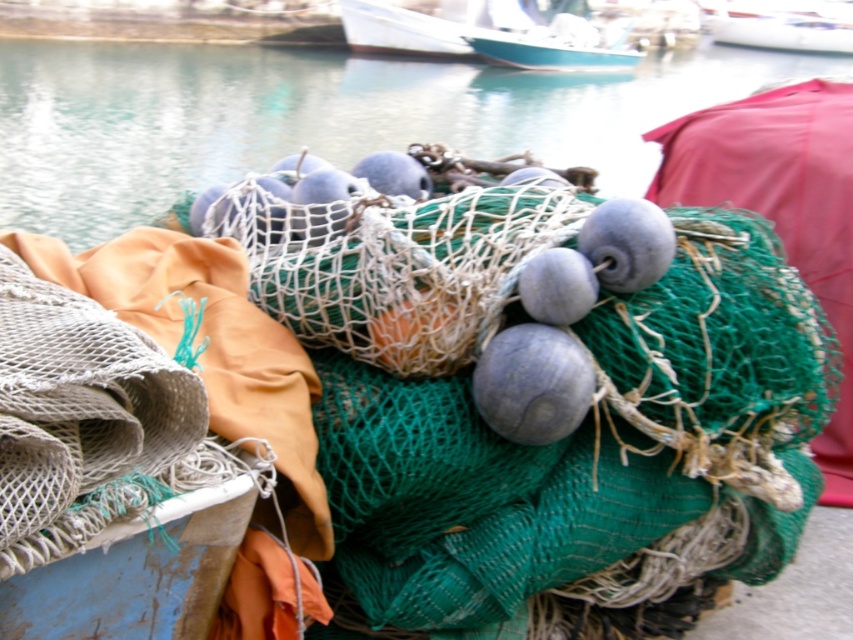
Is green netting at center positioned behind teal glossy boat at upper center?

No, green netting at center is in front of teal glossy boat at upper center.

Which is behind, point (548, 77) or point (576, 32)?

The point (576, 32) is behind.

The width and height of the screenshot is (853, 640). I want to click on green netting at center, so click(x=315, y=116).

Can you confirm if white glossy boat at upper right is smaller than teal glossy boat at upper center?

Correct, white glossy boat at upper right occupies less space than teal glossy boat at upper center.

Does white glossy boat at upper right appear on the right side of teal glossy boat at upper center?

Indeed, white glossy boat at upper right is positioned on the right side of teal glossy boat at upper center.

Is point (780, 8) positioned before point (538, 45)?

That is False.

The width and height of the screenshot is (853, 640). Find the location of `white glossy boat at upper right`. white glossy boat at upper right is located at coordinates (781, 22).

Which of these two, green netting at center or white glossy boat at upper right, stands taller?

green netting at center is taller.

Looking at this image, measure the distance between point [734,83] and camera.

The distance of point [734,83] from camera is 15.47 meters.

The width and height of the screenshot is (853, 640). Find the location of `green netting at center`. green netting at center is located at coordinates (315, 116).